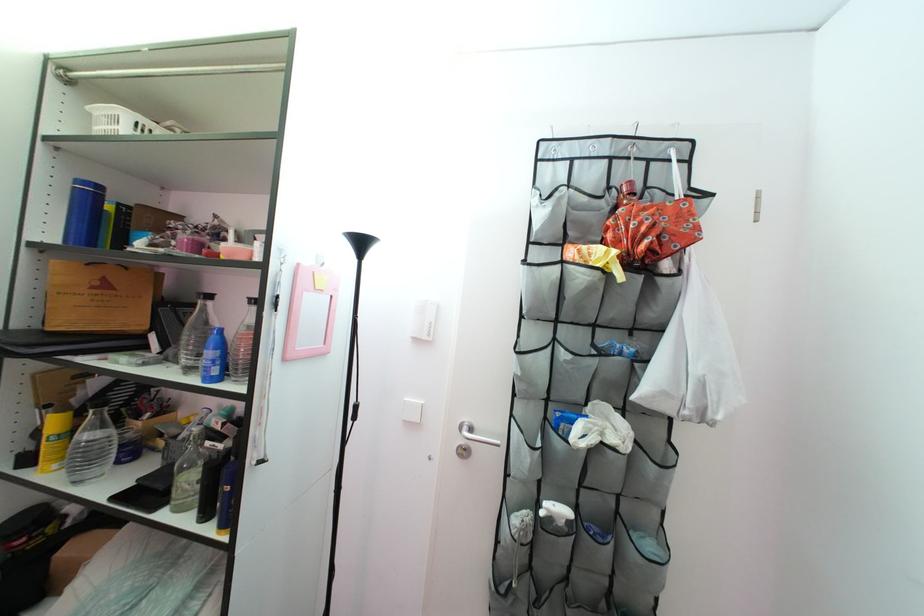
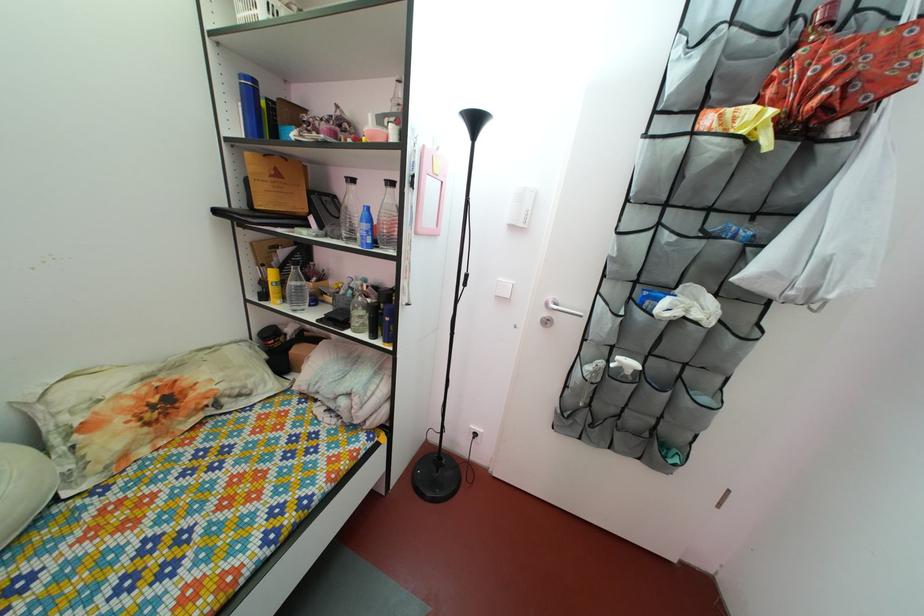
The point at (55, 415) is marked in the first image. Where is the corresponding point in the second image?

(272, 274)